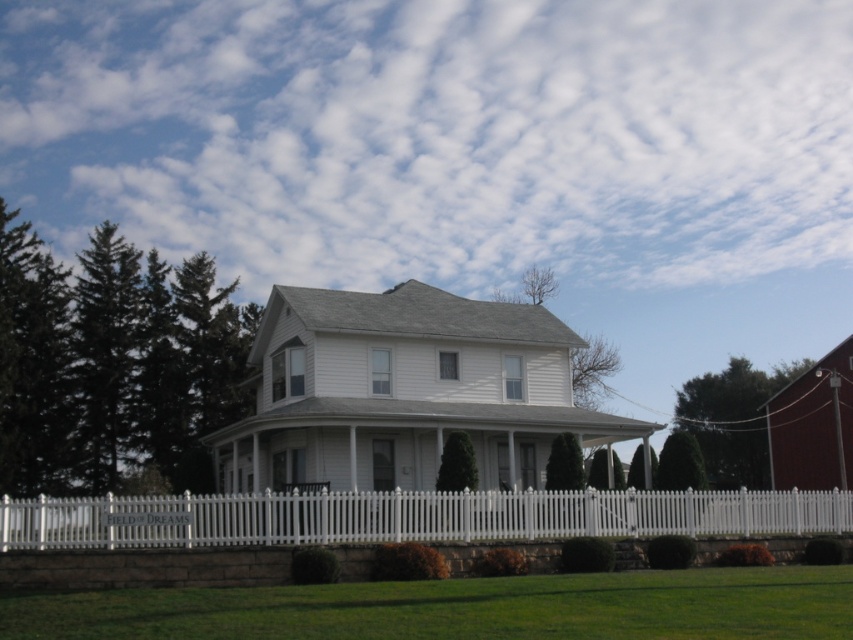
Which is more to the left, white wood barn at center or white picket fence at lower center?

From the viewer's perspective, white wood barn at center appears more on the left side.

Which of these two, white wood barn at center or white picket fence at lower center, stands taller?

Standing taller between the two is white wood barn at center.

Which is behind, point (592, 413) or point (368, 493)?

Point (592, 413)

You are a GUI agent. You are given a task and a screenshot of the screen. Output one action in this format:
    pyautogui.click(x=<x>, y=<y>)
    Task: Click on the white wood barn at center
    The width and height of the screenshot is (853, 640).
    Given the screenshot: What is the action you would take?
    click(x=397, y=404)

Which is behind, point (352, 486) or point (206, 593)?

The point (352, 486) is more distant.

Which is below, white wood barn at center or green grass at lower center?

green grass at lower center

I want to click on white wood barn at center, so click(397, 404).

Locate an element on the screen. The image size is (853, 640). white wood barn at center is located at coordinates (397, 404).

Between green grass at lower center and white picket fence at lower center, which one has more height?

With more height is white picket fence at lower center.

Who is higher up, green grass at lower center or white picket fence at lower center?

green grass at lower center

You are a GUI agent. You are given a task and a screenshot of the screen. Output one action in this format:
    pyautogui.click(x=<x>, y=<y>)
    Task: Click on the green grass at lower center
    
    Given the screenshot: What is the action you would take?
    pyautogui.click(x=463, y=609)